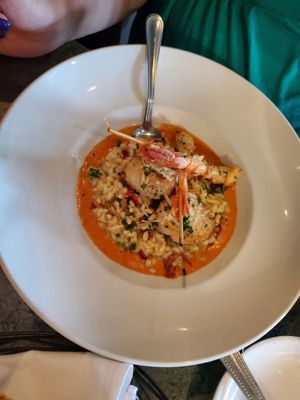
This screenshot has width=300, height=400. I want to click on empty plates, so click(x=278, y=363).